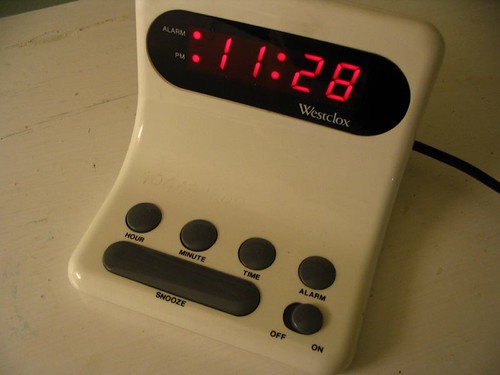
Image resolution: width=500 pixels, height=375 pixels. I want to click on alarm indicator, so click(172, 31).